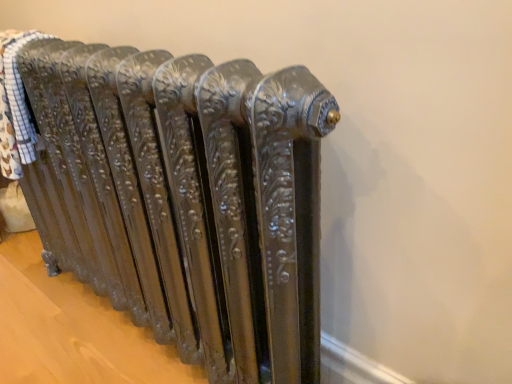
Find the location of a particular element. The height and width of the screenshot is (384, 512). free region under fluffy cotton blanket at left (from a real-world perspective) is located at coordinates (70, 291).